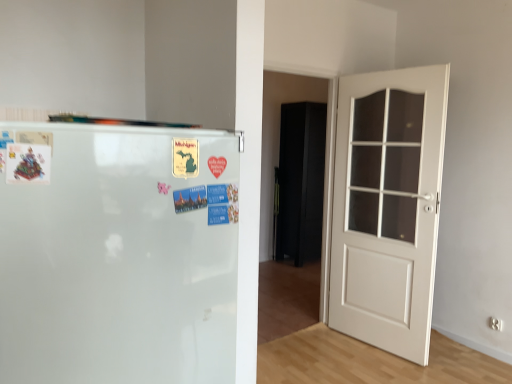
I want to click on vacant area that is in front of white wooden door at right, so click(382, 367).